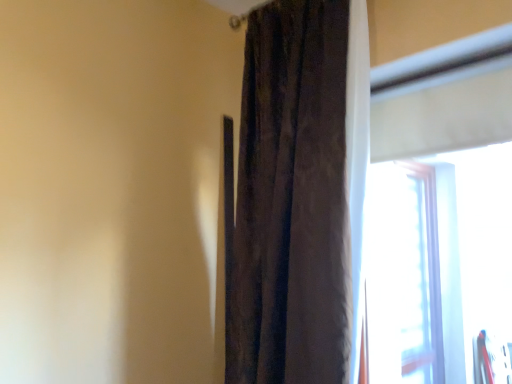
Question: Should I look upward or downward to see transparent plastic window at right?

Choices:
 (A) up
 (B) down

Answer: (B)

Question: Is velvet brown curtain at center to the right of transparent plastic window at right from the viewer's perspective?

Choices:
 (A) yes
 (B) no

Answer: (B)

Question: Can you confirm if velvet brown curtain at center is positioned to the left of transparent plastic window at right?

Choices:
 (A) no
 (B) yes

Answer: (B)

Question: Is velvet brown curtain at center completely or partially outside of transparent plastic window at right?

Choices:
 (A) no
 (B) yes

Answer: (B)

Question: Is velvet brown curtain at center surrounding transparent plastic window at right?

Choices:
 (A) no
 (B) yes

Answer: (A)

Question: Is velvet brown curtain at center smaller than transparent plastic window at right?

Choices:
 (A) yes
 (B) no

Answer: (B)

Question: Is transparent plastic window at right at the back of velvet brown curtain at center?

Choices:
 (A) no
 (B) yes

Answer: (A)

Question: Is transparent plastic window at right facing towards velvet brown curtain at center?

Choices:
 (A) no
 (B) yes

Answer: (A)

Question: Is transparent plastic window at right in contact with velvet brown curtain at center?

Choices:
 (A) yes
 (B) no

Answer: (B)

Question: Is the depth of transparent plastic window at right less than that of velvet brown curtain at center?

Choices:
 (A) yes
 (B) no

Answer: (A)

Question: Is transparent plastic window at right far from velvet brown curtain at center?

Choices:
 (A) no
 (B) yes

Answer: (B)

Question: Can velvet brown curtain at center be found inside transparent plastic window at right?

Choices:
 (A) no
 (B) yes

Answer: (A)

Question: Can you confirm if transparent plastic window at right is wider than velvet brown curtain at center?

Choices:
 (A) no
 (B) yes

Answer: (A)

Question: From the image's perspective, is velvet brown curtain at center above or below transparent plastic window at right?

Choices:
 (A) above
 (B) below

Answer: (A)